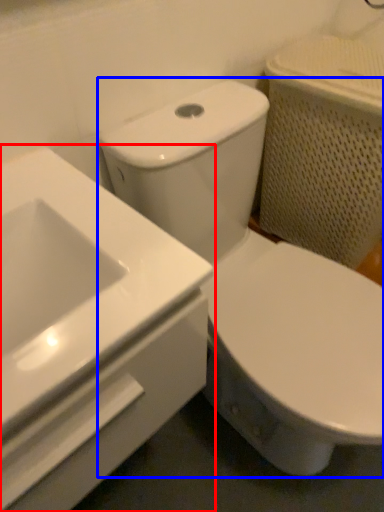
Question: Which of the following is the closest to the observer, sink (highlighted by a red box) or toilet (highlighted by a blue box)?

Choices:
 (A) sink
 (B) toilet

Answer: (A)